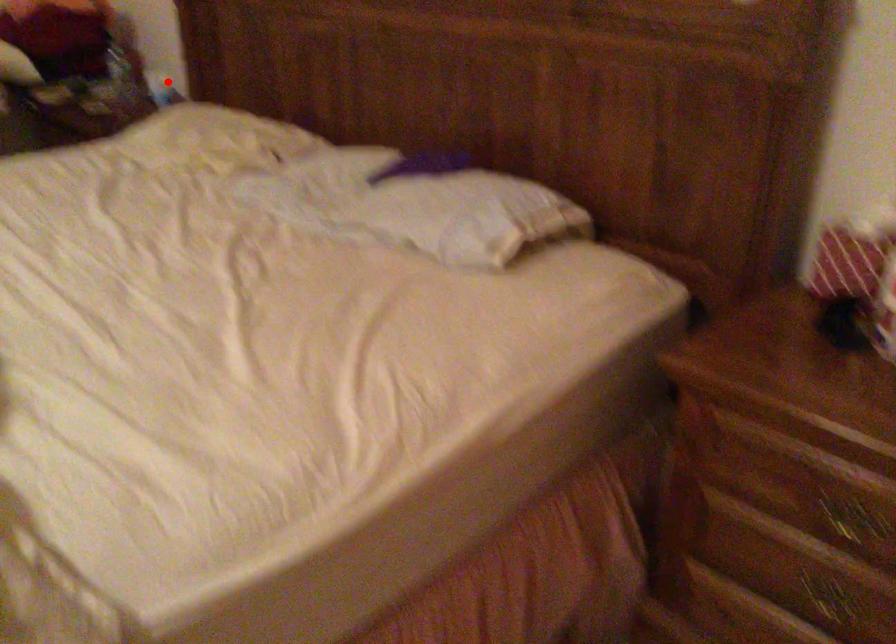
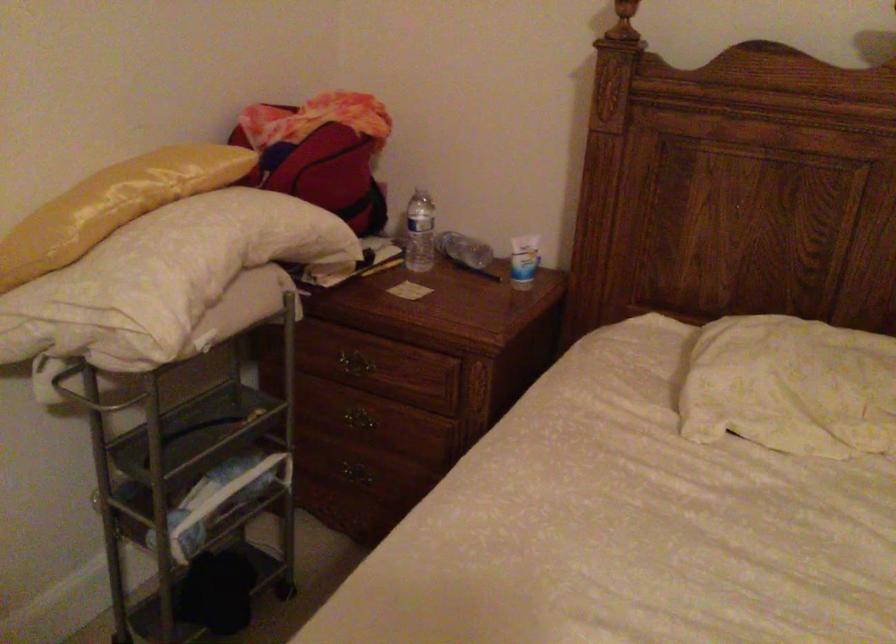
The point at the highlighted location is marked in the first image. Where is the corresponding point in the second image?

(523, 261)